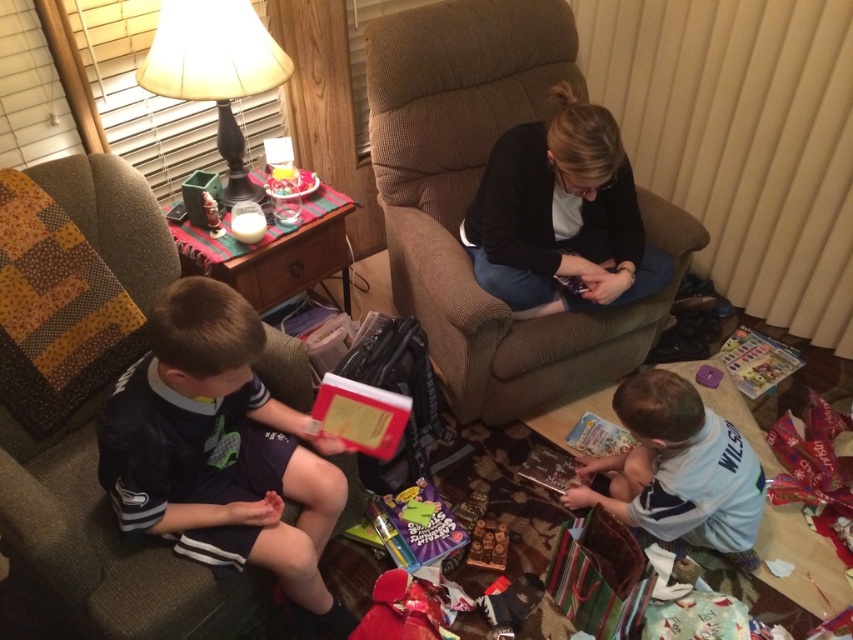
Looking at this image, you are a guest entering the living room and see the dark blue jersey at left and the matte beige lampshade at upper left. Which object is positioned more to the right side of the room?

The dark blue jersey at left is positioned more to the right side of the room compared to the matte beige lampshade at upper left, as it is located to the right of it.

From the picture: You are a parent trying to place a small gift on the floor between the two points, point(500, 376) and point(480, 524). Which point is closer to you so you can place the gift there?

Point(500, 376) is closer to you than point(480, 524), so you can place the gift there.